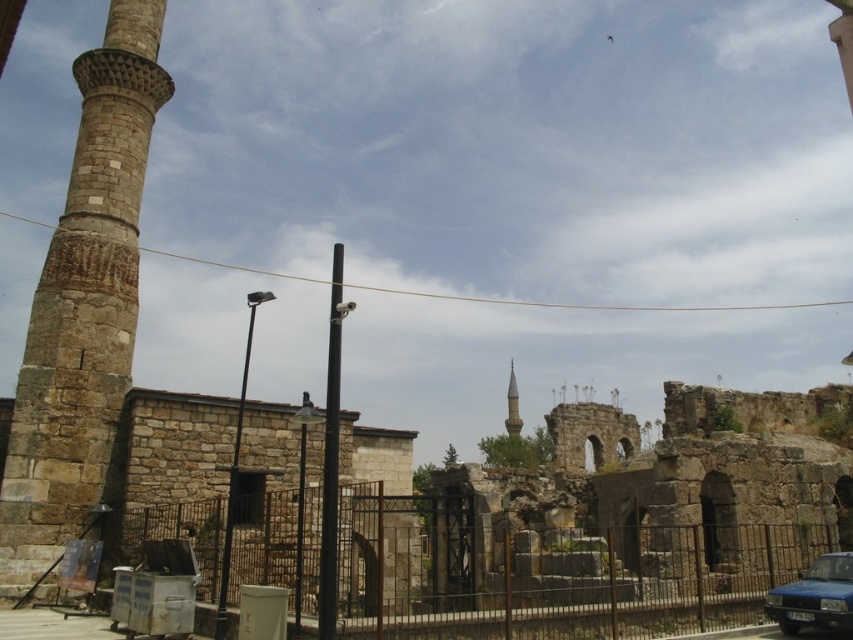
Question: Is rusty metal fence at center positioned in front of blue metallic car at lower right?

Choices:
 (A) no
 (B) yes

Answer: (A)

Question: Which object is the farthest from the blue metallic car at lower right?

Choices:
 (A) rusty metal fence at center
 (B) smooth stone minaret at center

Answer: (B)

Question: Can you confirm if blue metallic car at lower right is thinner than smooth stone minaret at center?

Choices:
 (A) no
 (B) yes

Answer: (B)

Question: Is blue metallic car at lower right smaller than smooth stone minaret at center?

Choices:
 (A) no
 (B) yes

Answer: (B)

Question: Which object is positioned closest to the rusty metal fence at center?

Choices:
 (A) blue metallic car at lower right
 (B) smooth stone minaret at center

Answer: (A)

Question: Among these points, which one is farthest from the camera?

Choices:
 (A) (206, 499)
 (B) (518, 412)

Answer: (B)